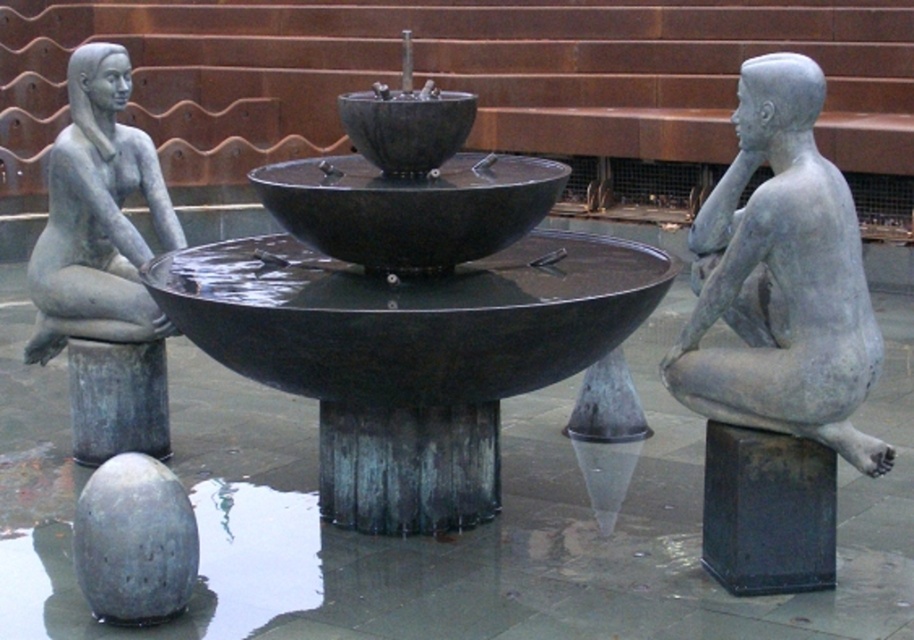
Question: Is black matte pillar at lower right bigger than polished metal cone at center?

Choices:
 (A) yes
 (B) no

Answer: (A)

Question: Which object is closer to the camera taking this photo?

Choices:
 (A) matte gray statue at left
 (B) polished metal cone at center
 (C) bronze textured pillar at left

Answer: (A)

Question: Does matte black fountain at center have a larger size compared to matte gray statue at left?

Choices:
 (A) no
 (B) yes

Answer: (B)

Question: Observing the image, what is the correct spatial positioning of rusty metal pillar at center in reference to black matte pillar at lower right?

Choices:
 (A) right
 (B) left

Answer: (B)

Question: Which object appears closest to the camera in this image?

Choices:
 (A) black matte pillar at lower right
 (B) polished metal cone at center
 (C) bronze textured pillar at left
 (D) matte black fountain at center

Answer: (D)

Question: Which point is closer to the camera taking this photo?

Choices:
 (A) (141, 397)
 (B) (486, 253)
 (C) (434, 531)
 (D) (798, 461)

Answer: (D)